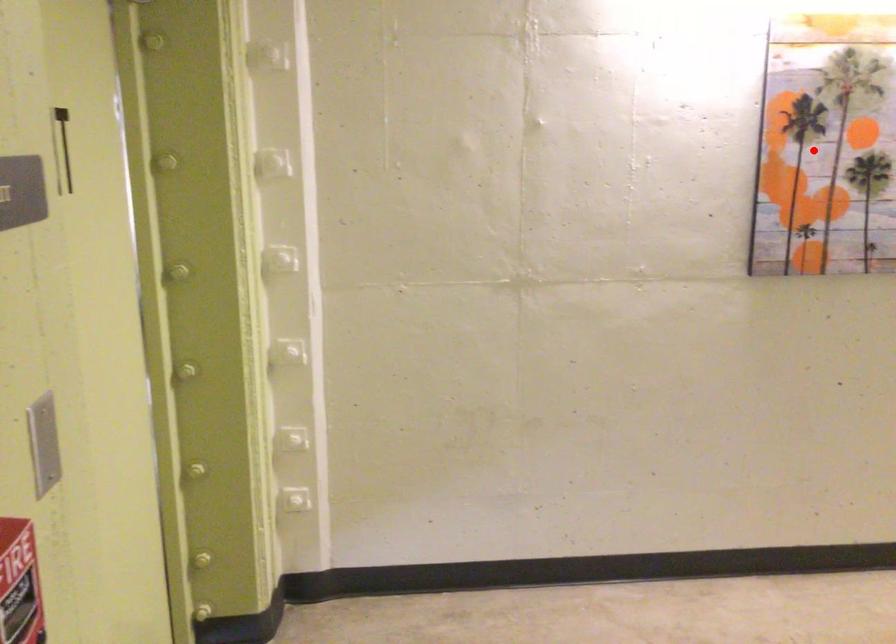
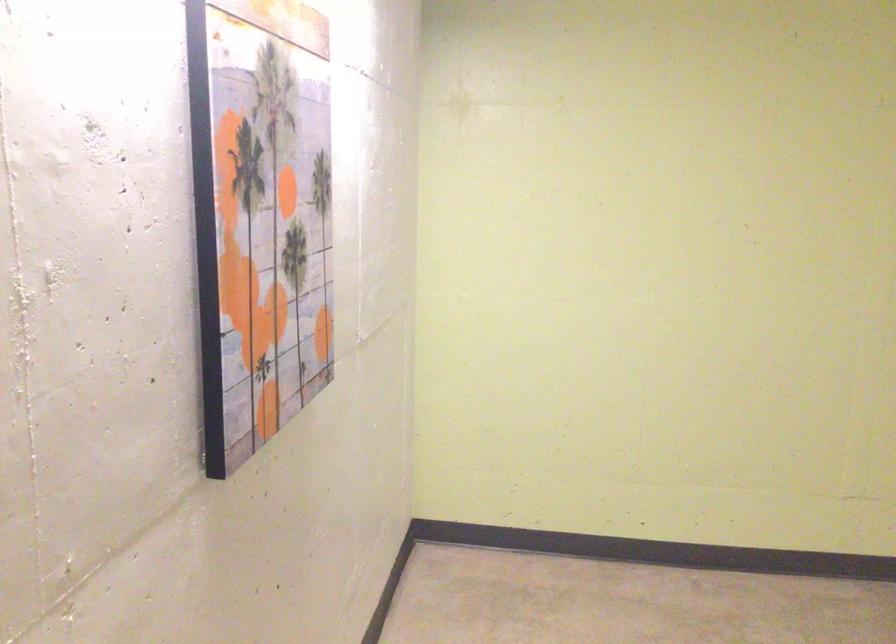
The point at the highlighted location is marked in the first image. Where is the corresponding point in the second image?

(260, 216)